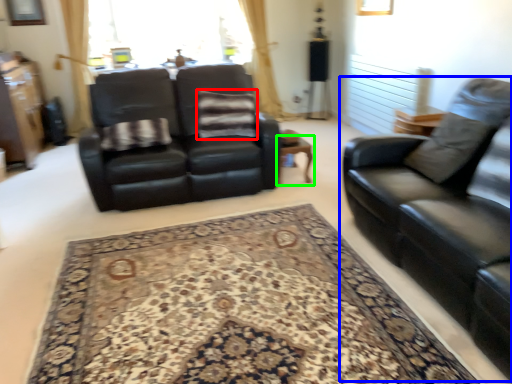
Question: Which is farther away from pillow (highlighted by a red box)? studio couch (highlighted by a blue box) or table (highlighted by a green box)?

Choices:
 (A) studio couch
 (B) table

Answer: (A)